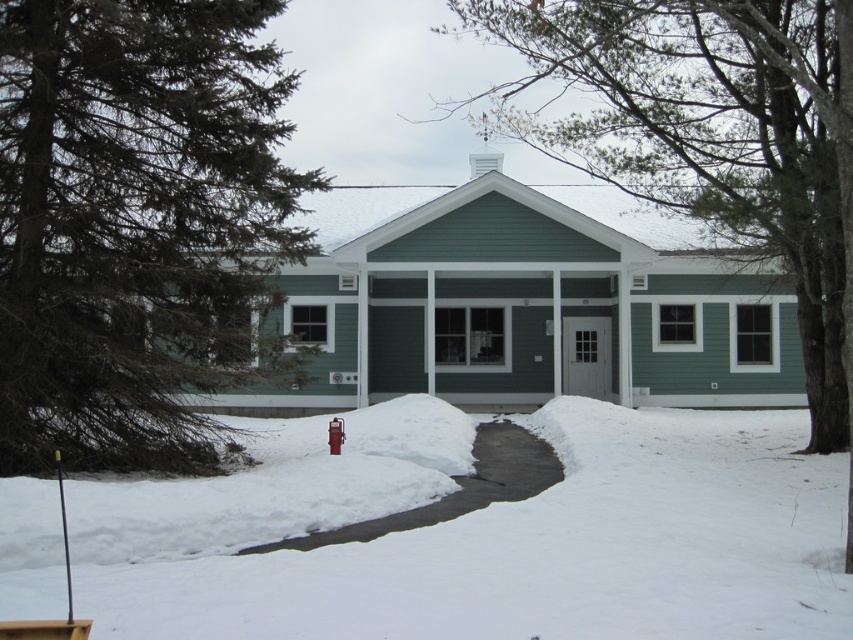
You are a mail carrier trying to deliver a package to the house. The path is covered in snow, but you notice the white powdery snow at center and the red metallic hydrant at center. Which object is positioned to the right side of the other?

The white powdery snow at center is to the right of the red metallic hydrant at center.

You are a delivery person approaching the house and need to avoid stepping on the snow. Which object should you be careful not to step on, the green textured pine tree at left or the white powdery snow at center?

You should be careful not to step on the white powdery snow at center because the green textured pine tree at left is above it and not on the ground where you would walk.

You are standing at the front door of the house and looking towards the red fire hydrant. Which direction should you turn to see the green textured pine tree at left represented by point (140, 228)?

The green textured pine tree at left represented by point (140, 228) is located to the left of the red fire hydrant. So, you should turn to your left to see it.